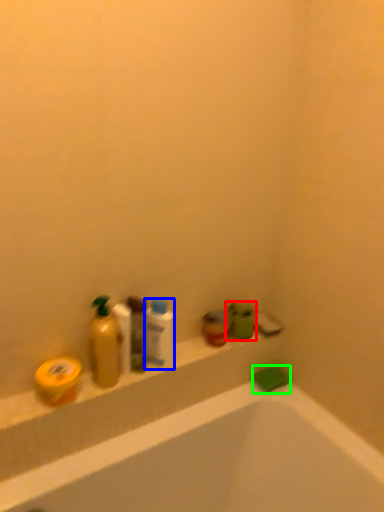
Question: Considering the real-world distances, which object is farthest from toiletry (highlighted by a red box)? mouthwash (highlighted by a blue box) or soap (highlighted by a green box)?

Choices:
 (A) mouthwash
 (B) soap

Answer: (A)